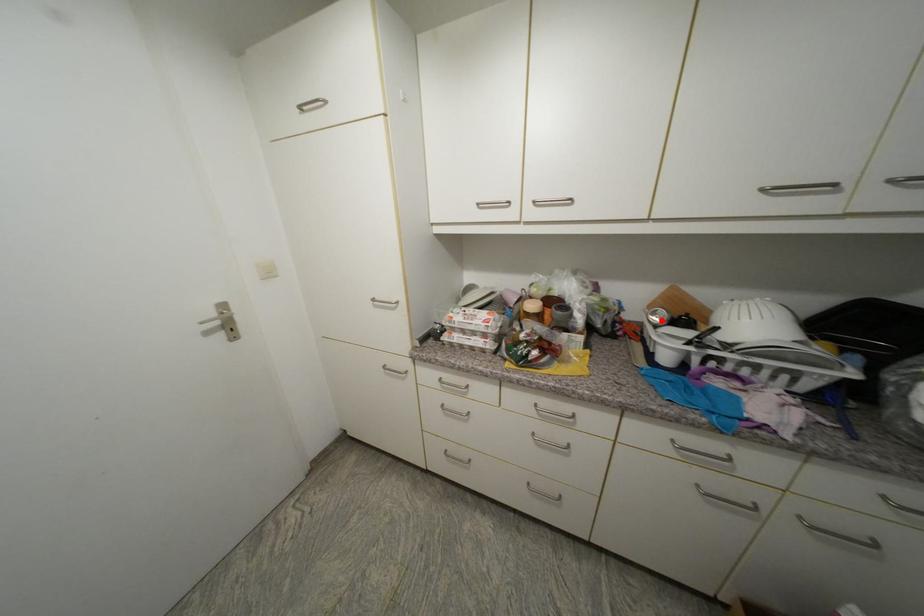
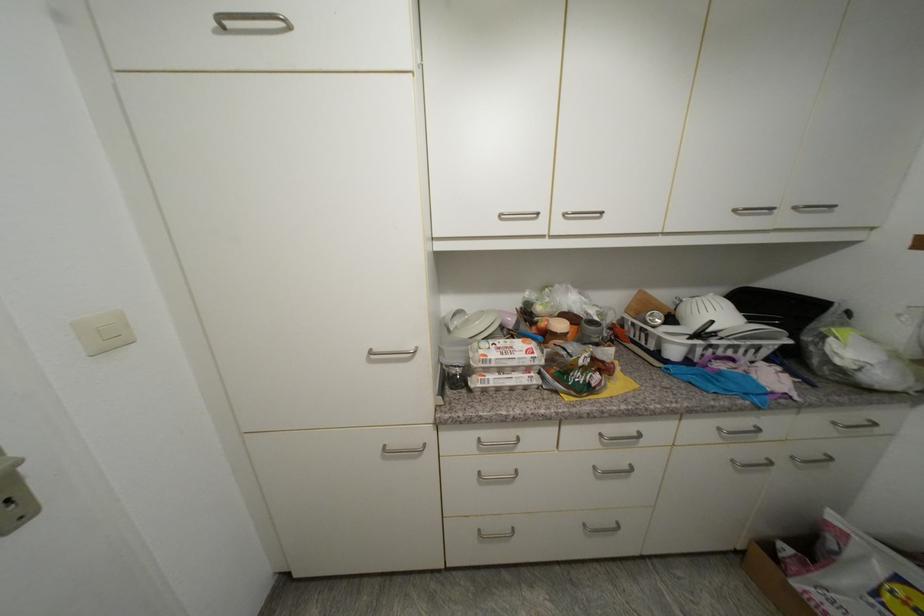
Locate, in the second image, the point that corresponds to the highlighted location in the first image.

(663, 323)